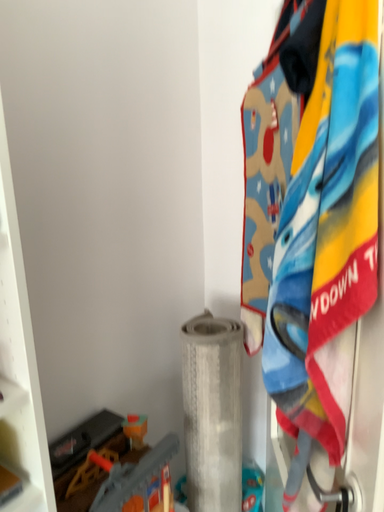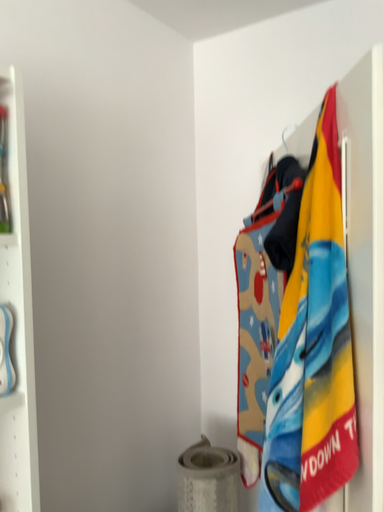
Question: How did the camera likely rotate when shooting the video?

Choices:
 (A) rotated upward
 (B) rotated downward

Answer: (A)